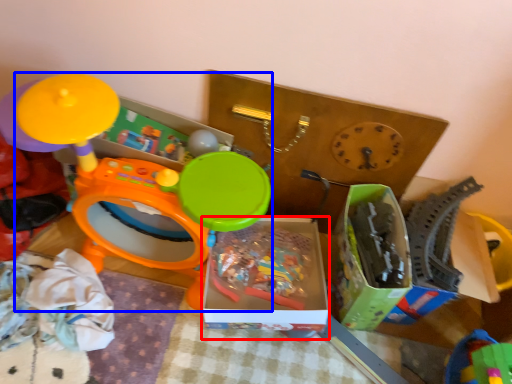
Question: Among these objects, which one is nearest to the camera, storage box (highlighted by a red box) or toy (highlighted by a blue box)?

Choices:
 (A) storage box
 (B) toy

Answer: (B)